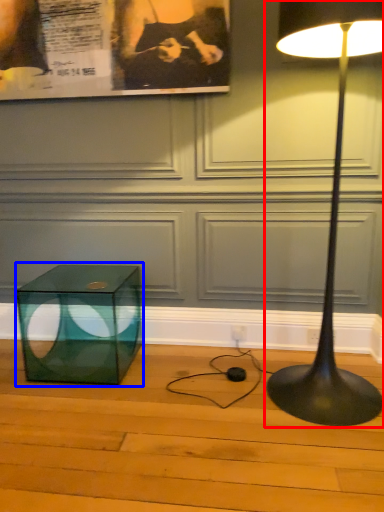
Question: Which point is further to the camera, lamp (highlighted by a red box) or table (highlighted by a blue box)?

Choices:
 (A) lamp
 (B) table

Answer: (B)